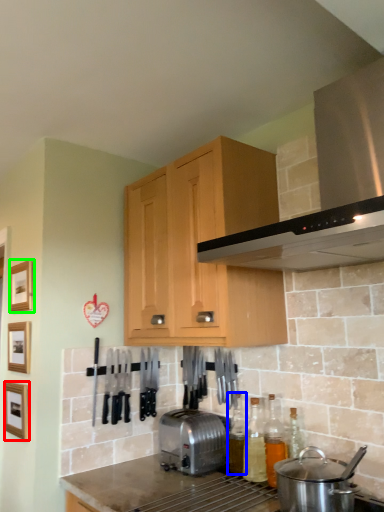
Question: Considering the real-world distances, which object is closest to picture frame (highlighted by a red box)? bottle (highlighted by a blue box) or picture frame (highlighted by a green box).

Choices:
 (A) bottle
 (B) picture frame

Answer: (B)